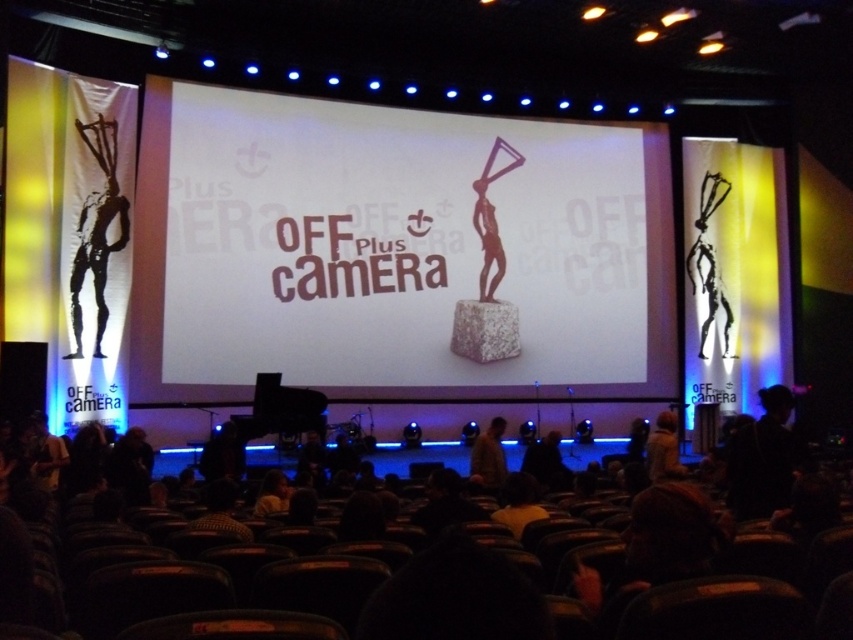
Does point (210, 228) come farther from viewer compared to point (86, 236)?

Yes, it is.

Does point (495, 298) come in front of point (115, 188)?

No, it is not.

Find the location of a particular element. white paper at center is located at coordinates [x=392, y=250].

Is white paper at center thinner than dark brown leather jacket at center?

No, white paper at center is not thinner than dark brown leather jacket at center.

Is white paper at center smaller than dark brown leather jacket at center?

Actually, white paper at center might be larger than dark brown leather jacket at center.

What do you see at coordinates (392, 250) in the screenshot?
I see `white paper at center` at bounding box center [392, 250].

This screenshot has width=853, height=640. Find the location of `white paper at center`. white paper at center is located at coordinates (392, 250).

Between point (80, 205) and point (665, 464), which one is positioned in front?

Point (80, 205)

Does silvery metallic statue at left have a greater height compared to fuzzy beige coat at lower right?

Yes, silvery metallic statue at left is taller than fuzzy beige coat at lower right.

This screenshot has height=640, width=853. What do you see at coordinates (97, 230) in the screenshot?
I see `silvery metallic statue at left` at bounding box center [97, 230].

You are a GUI agent. You are given a task and a screenshot of the screen. Output one action in this format:
    pyautogui.click(x=<x>, y=<y>)
    Task: Click on the silvery metallic statue at left
    This screenshot has width=853, height=640.
    Given the screenshot: What is the action you would take?
    pyautogui.click(x=97, y=230)